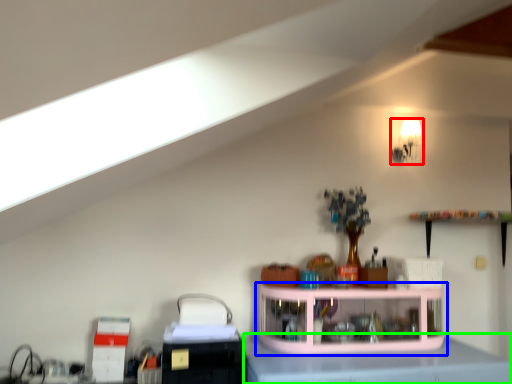
Question: Based on their relative distances, which object is nearer to light fixture (highlighted by a red box)? Choose from shelf (highlighted by a blue box) and counter top (highlighted by a green box).

Choices:
 (A) shelf
 (B) counter top

Answer: (A)